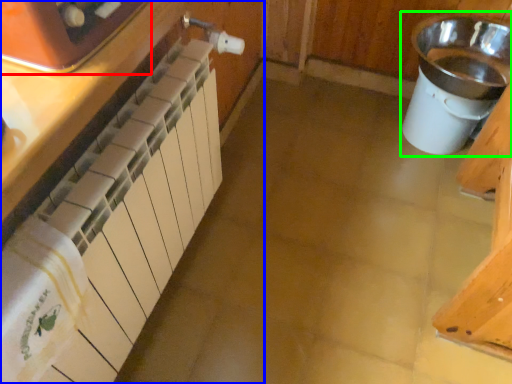
Question: Estimate the real-world distances between objects in this image. Which object is farther from home appliance (highlighted by a red box), cabinetry (highlighted by a blue box) or sink (highlighted by a green box)?

Choices:
 (A) cabinetry
 (B) sink

Answer: (B)